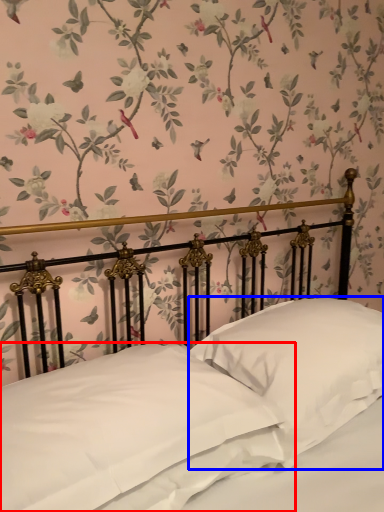
Question: Which object is closer to the camera taking this photo, pillow (highlighted by a red box) or pillow (highlighted by a blue box)?

Choices:
 (A) pillow
 (B) pillow

Answer: (A)